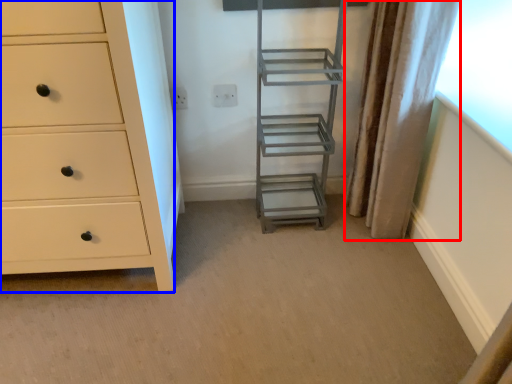
Question: Which point is closer to the camera, curtain (highlighted by a red box) or chest of drawers (highlighted by a blue box)?

Choices:
 (A) curtain
 (B) chest of drawers

Answer: (B)